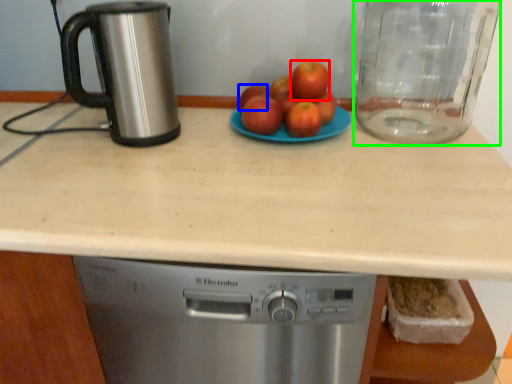
Question: Which object is the closest to the apple (highlighted by a red box)? Choose among these: apple (highlighted by a blue box) or glass jar (highlighted by a green box).

Choices:
 (A) apple
 (B) glass jar

Answer: (A)